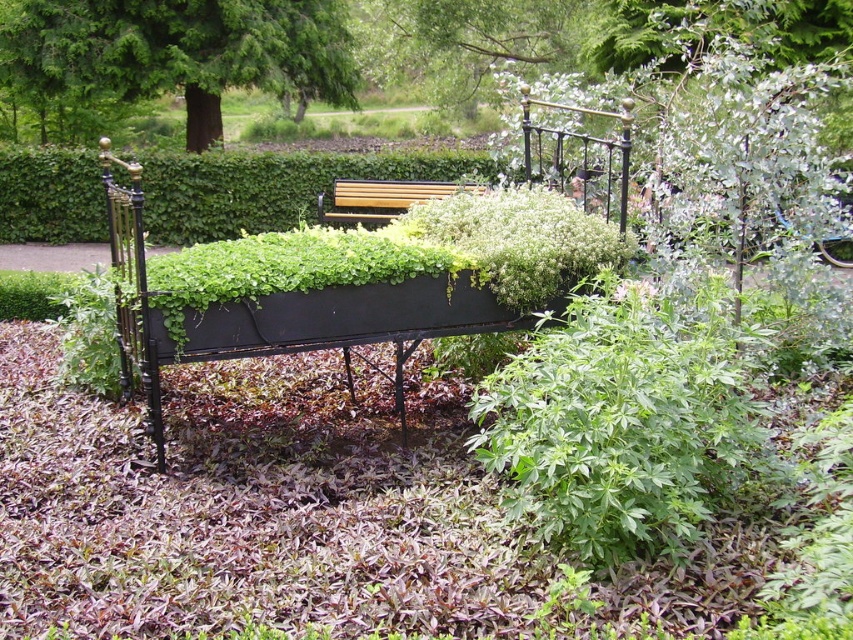
You are standing at the entrance of the garden and want to sit down on the black metal bench at center. Based on the coordinates provided, in which direction should you walk to reach it?

The black metal bench at center is located at coordinates point (384,292), so you should walk towards the center of the garden to reach it.

From the picture: You are planning to place a small potted plant between the black metal bench at center and the green leafy hedge at center. Based on their sizes, which object should the potted plant be closer to?

The black metal bench at center is smaller than the green leafy hedge at center, so the potted plant should be placed closer to the black metal bench at center to maintain visual balance.

You are planning to install a new pathway between the black metal bench at center and the green leafy hedge at center in the garden. The pathway requires a minimum of 6 meters to be functional. Can the existing space accommodate this pathway?

The distance between the black metal bench at center and the green leafy hedge at center is 6.90 meters, which exceeds the required 6 meters. Therefore, the existing space can accommodate the pathway.